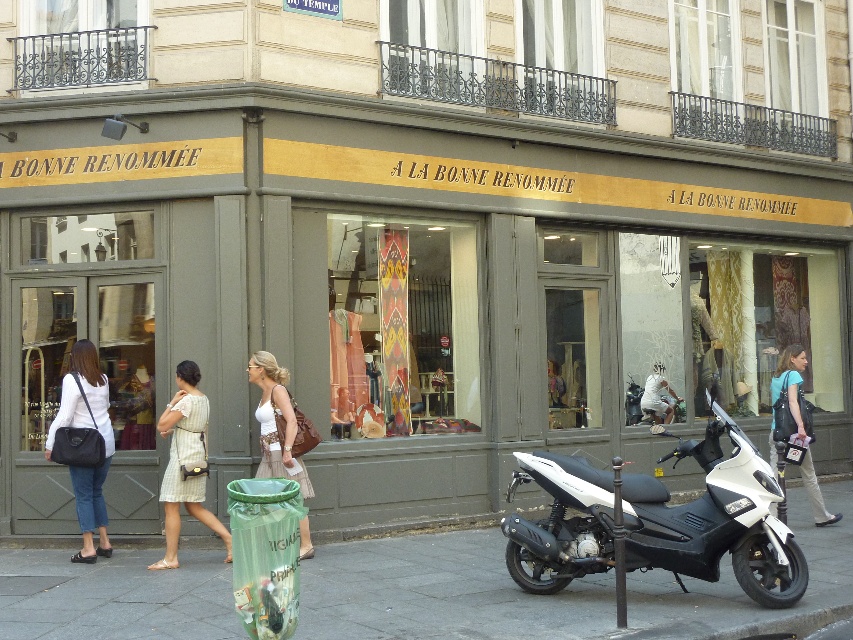
You are a delivery person who needs to park your white matte scooter at center near the blue fabric backpack at lower right. Can you park the scooter next to the backpack without blocking the backpack?

The white matte scooter at center might be wider than blue fabric backpack at lower right, so there is a possibility that parking the scooter next to the backpack could block it depending on their widths. Check the actual width before parking.

You are a customer at the boutique and want to choose between the striped fabric dress at center and the blue fabric backpack at lower right. Which item is narrower?

The striped fabric dress at center is thinner than the blue fabric backpack at lower right, so the striped fabric dress at center is narrower.

You are a customer looking to buy a dress and a backpack. You see the white fabric dress at center and the blue fabric backpack at lower right in the shop window. Which item is shorter in height?

The white fabric dress at center is not as tall as the blue fabric backpack at lower right, so the dress is shorter in height.